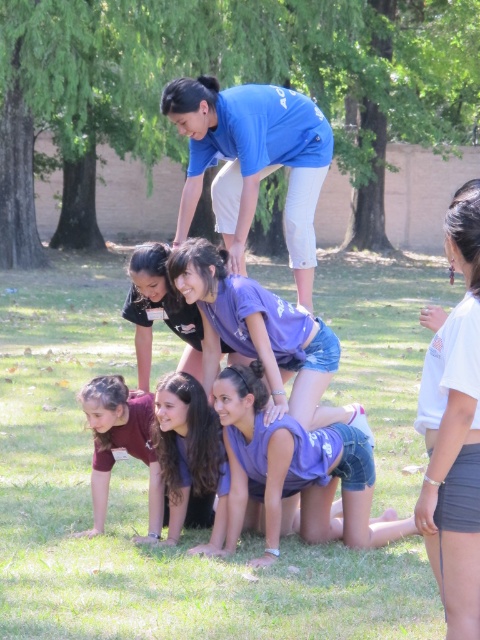
You are standing in the park and see the human pyramid with the green grass at center and the purple denim shorts at lower center. Which object is located to the right of the other?

The green grass at center is positioned on the right side of purple denim shorts at lower center.